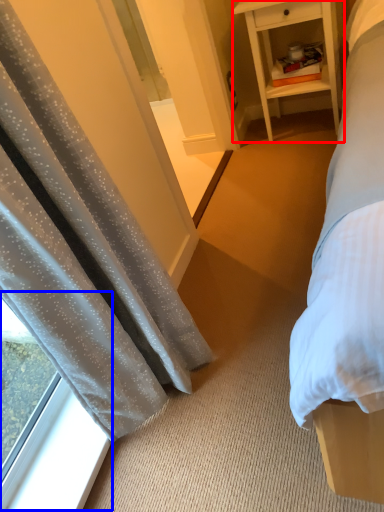
Question: Which point is closer to the camera, nightstand (highlighted by a red box) or window (highlighted by a blue box)?

Choices:
 (A) nightstand
 (B) window

Answer: (B)